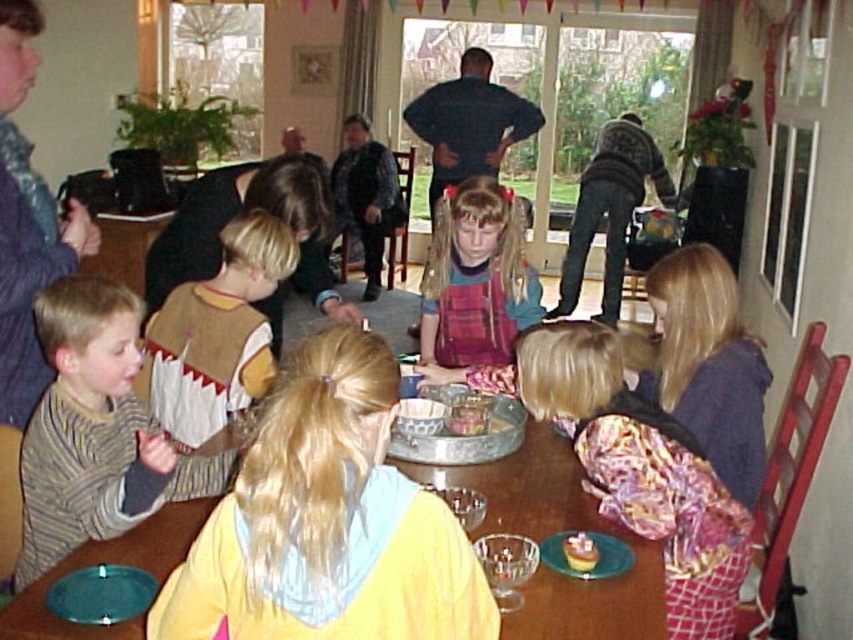
You are a guest at the birthday party and need to choose between wearing the brown felt vest at left or the plaid fabric dress at center. If you want something wider, which should you choose?

The brown felt vest at left is wider than the plaid fabric dress at center, so you should choose the brown felt vest at left if you want something wider.

You are a guest at this birthday party and want to take a photo of the wooden table at center without including the dark blue shirt at upper center in the frame. Is it possible to position yourself in a way that achieves this?

The wooden table at center is in front of the dark blue shirt at upper center, so by positioning yourself directly in front of the wooden table at center, you can exclude the dark blue shirt at upper center from the photo frame.